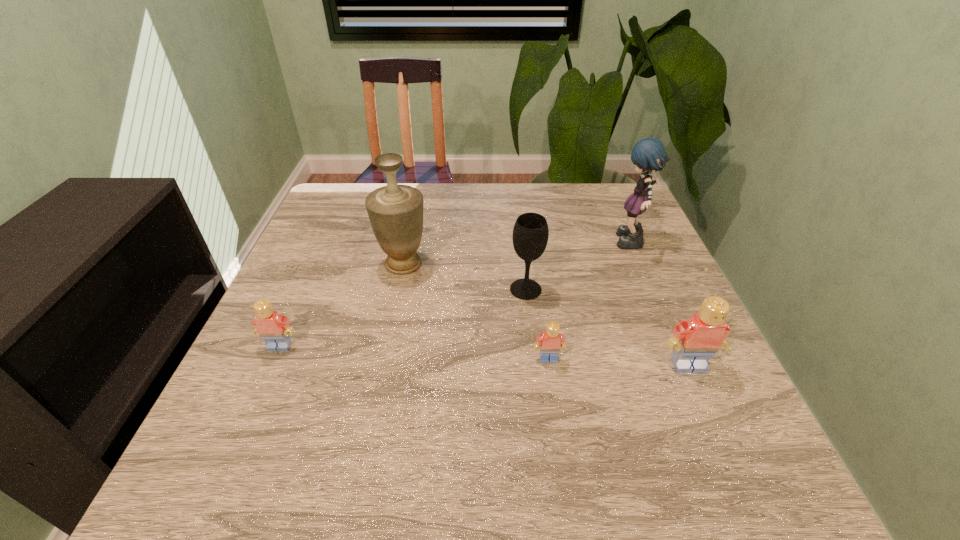
You are a GUI agent. You are given a task and a screenshot of the screen. Output one action in this format:
    pyautogui.click(x=<x>, y=<y>)
    Task: Click on the vacant point located on the front-facing side of the rightmost Lego
    
    Given the screenshot: What is the action you would take?
    pyautogui.click(x=708, y=411)

I want to click on vacant space located on the front-facing side of the rag doll, so click(556, 244).

Find the location of a particular element. The width and height of the screenshot is (960, 540). vacant space situated on the front-facing side of the rag doll is located at coordinates (510, 244).

Image resolution: width=960 pixels, height=540 pixels. What are the coordinates of `vacant space located on the front-facing side of the rag doll` in the screenshot? It's located at (502, 244).

In order to click on vacant space located 0.280m on the left of the wineglass in this screenshot , I will do `click(388, 289)`.

At what (x,y) coordinates should I click in order to perform the action: click on vacant space situated on the back of the urn. Please return your answer as a coordinate pair (x, y). This screenshot has width=960, height=540. Looking at the image, I should click on [419, 191].

Locate an element on the screen. object located at the left edge is located at coordinates (274, 329).

Where is `Lego located at the right edge`? This screenshot has height=540, width=960. Lego located at the right edge is located at coordinates click(696, 340).

I want to click on rag doll that is at the right edge, so click(648, 154).

Where is `vacant space at the far edge of the desktop`? vacant space at the far edge of the desktop is located at coordinates [x=400, y=183].